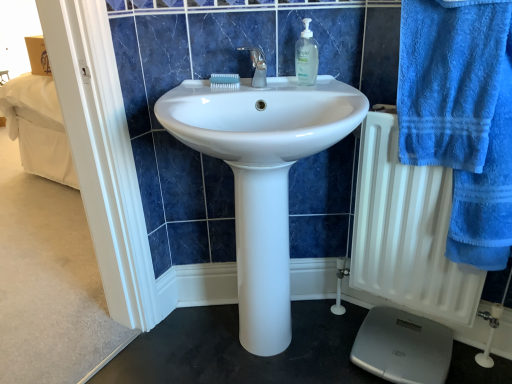
Question: From the image's perspective, is white matte radiator at right located above or below clear plastic soap dispenser at upper center?

Choices:
 (A) below
 (B) above

Answer: (A)

Question: Relative to clear plastic soap dispenser at upper center, is white matte radiator at right in front or behind?

Choices:
 (A) behind
 (B) front

Answer: (B)

Question: Which is farther from the white glossy sink at center?

Choices:
 (A) blue terry cloth towel at right
 (B) gray plastic scale at lower right
 (C) white matte radiator at right
 (D) clear plastic soap dispenser at upper center

Answer: (B)

Question: Based on their relative distances, which object is nearer to the clear plastic soap dispenser at upper center?

Choices:
 (A) blue terry cloth towel at right
 (B) white glossy sink at center
 (C) white matte radiator at right
 (D) gray plastic scale at lower right

Answer: (B)